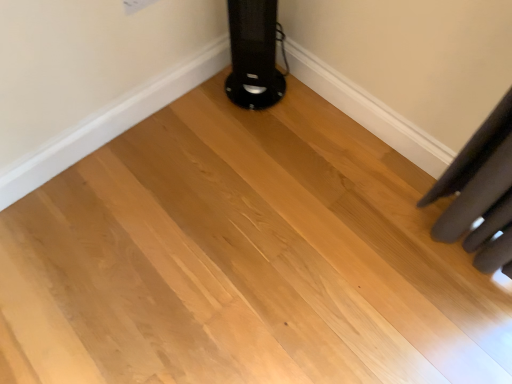
Image resolution: width=512 pixels, height=384 pixels. What are the coordinates of `spots to the right of black plastic speaker at center` in the screenshot? It's located at (290, 101).